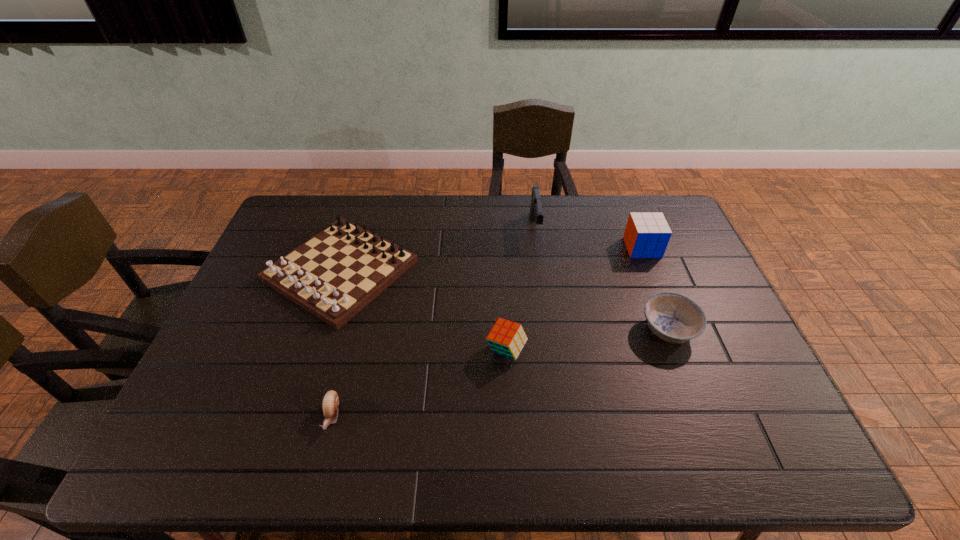
The image size is (960, 540). I want to click on vacant area that lies between the bowl and the fourth object from left to right, so click(x=602, y=279).

Locate an element on the screen. The image size is (960, 540). blank region between the third object from right to left and the chessboard is located at coordinates (438, 249).

The image size is (960, 540). I want to click on vacant point located between the fourth tallest object and the farther cube, so click(x=492, y=259).

The width and height of the screenshot is (960, 540). Find the location of `free space between the right cube and the fourth object from right to left`. free space between the right cube and the fourth object from right to left is located at coordinates (574, 299).

Find the location of a particular element. This screenshot has width=960, height=540. unoccupied position between the farther cube and the nearest object is located at coordinates 487,332.

What are the coordinates of `object that is the second closest to the pistol` in the screenshot? It's located at (672, 317).

Locate an element on the screen. object that stands as the second closest to the bowl is located at coordinates (506, 338).

You are a GUI agent. You are given a task and a screenshot of the screen. Output one action in this format:
    pyautogui.click(x=<x>, y=<y>)
    Task: Click on the free space that satisfies the following two spatial constraints: 1. on the back side of the right cube; 2. on the right side of the fourth tallest object
    This screenshot has width=960, height=540.
    Given the screenshot: What is the action you would take?
    pyautogui.click(x=348, y=247)

Where is `vacant region that satisfies the following two spatial constraints: 1. aim along the barrel of the farther cube; 2. on the left side of the fourth object from left to right`? vacant region that satisfies the following two spatial constraints: 1. aim along the barrel of the farther cube; 2. on the left side of the fourth object from left to right is located at coordinates (539, 247).

This screenshot has height=540, width=960. In order to click on free space in the image that satisfies the following two spatial constraints: 1. aim along the barrel of the bowl; 2. on the left side of the tallest object in this screenshot , I will do `click(550, 330)`.